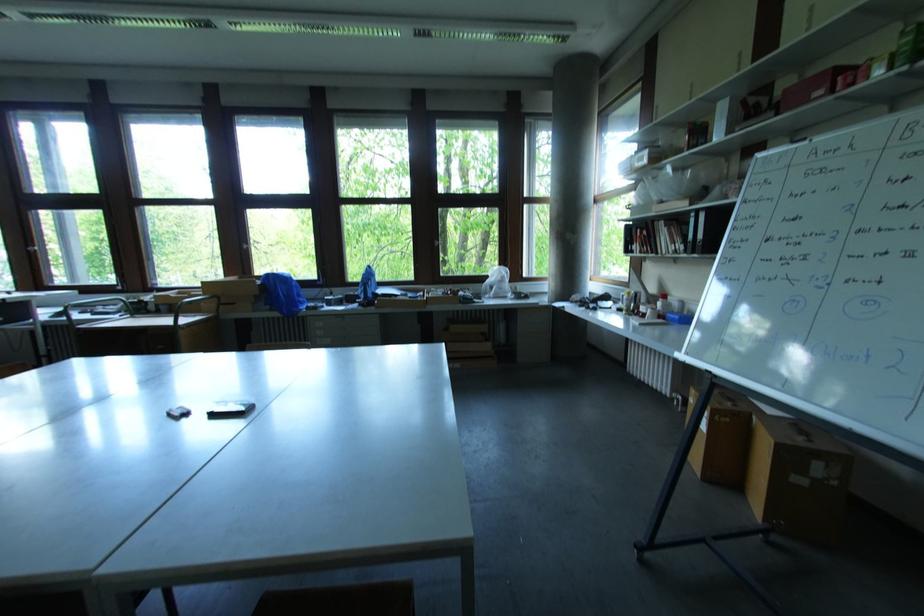
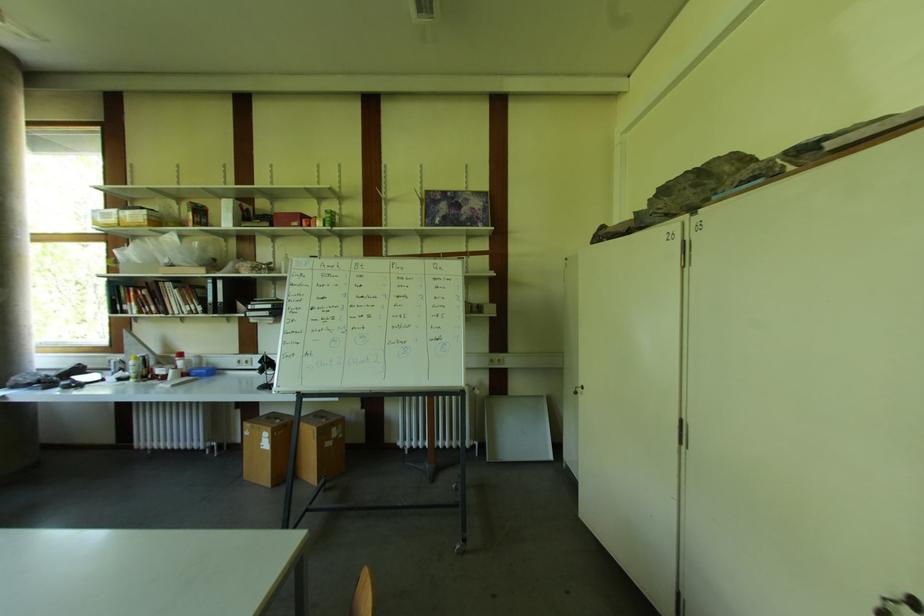
Question: How did the camera likely rotate?

Choices:
 (A) Left
 (B) Right
 (C) Up
 (D) Down

Answer: (B)